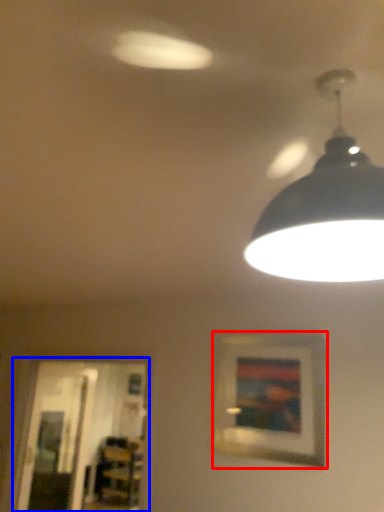
Question: Which object appears farthest to the camera in this image, picture frame (highlighted by a red box) or glass door (highlighted by a blue box)?

Choices:
 (A) picture frame
 (B) glass door

Answer: (B)